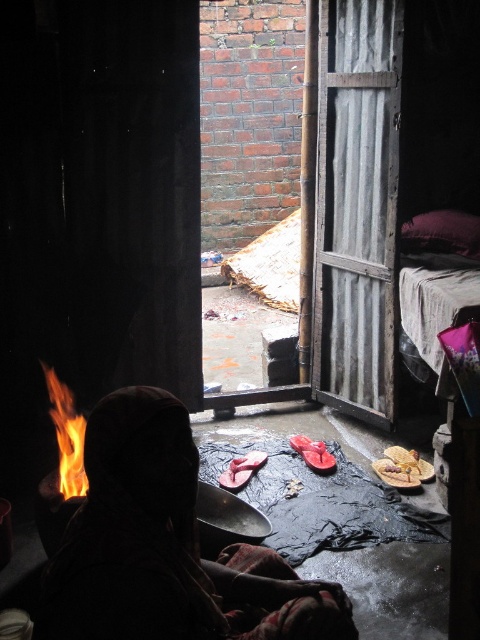
In the scene shown: Is silhouette fabric at center positioned before flameflame at center?

Yes, silhouette fabric at center is in front of flameflame at center.

Does silhouette fabric at center have a lesser width compared to flameflame at center?

No.

Where is `silhouette fabric at center`? The height and width of the screenshot is (640, 480). silhouette fabric at center is located at coordinates (167, 547).

At what (x,y) coordinates should I click in order to perform the action: click on silhouette fabric at center. Please return your answer as a coordinate pair (x, y). This screenshot has width=480, height=640. Looking at the image, I should click on (167, 547).